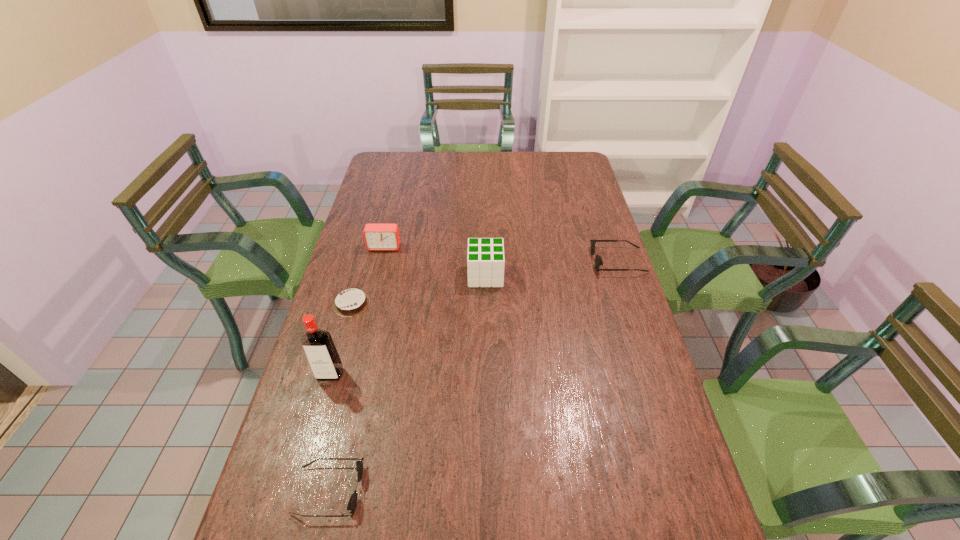
Find the location of a particular element. Image resolution: width=960 pixels, height=540 pixels. vacant space at the left edge of the desktop is located at coordinates (351, 246).

In the image, there is a desktop. At what (x,y) coordinates should I click in order to perform the action: click on free space at the right edge. Please return your answer as a coordinate pair (x, y). Looking at the image, I should click on (601, 249).

Identify the location of vacant space at the far right corner. Image resolution: width=960 pixels, height=540 pixels. (x=588, y=172).

Image resolution: width=960 pixels, height=540 pixels. I want to click on free point between the cube and the taller sunglasses, so click(552, 268).

Locate an element on the screen. This screenshot has width=960, height=540. vacant space that is in between the second shortest object and the chocolate cake is located at coordinates (340, 397).

Find the location of `unoccupied position between the chocolate cake and the third tallest object`. unoccupied position between the chocolate cake and the third tallest object is located at coordinates (368, 275).

Locate an element on the screen. This screenshot has height=540, width=960. free spot between the taller sunglasses and the nearest object is located at coordinates tap(473, 376).

Identify which object is located as the nearest to the shortest object. Please provide its 2D coordinates. Your answer should be formatted as a tuple, i.e. [(x, y)], where the tuple contains the x and y coordinates of a point satisfying the conditions above.

[(320, 350)]

This screenshot has height=540, width=960. In order to click on object that is the second closest to the chocolate cake in this screenshot , I will do `click(378, 237)`.

Image resolution: width=960 pixels, height=540 pixels. What are the coordinates of `vacant space that satisfies the following two spatial constraints: 1. on the red face of the cube; 2. on the front and back of the vodka` in the screenshot? It's located at (487, 374).